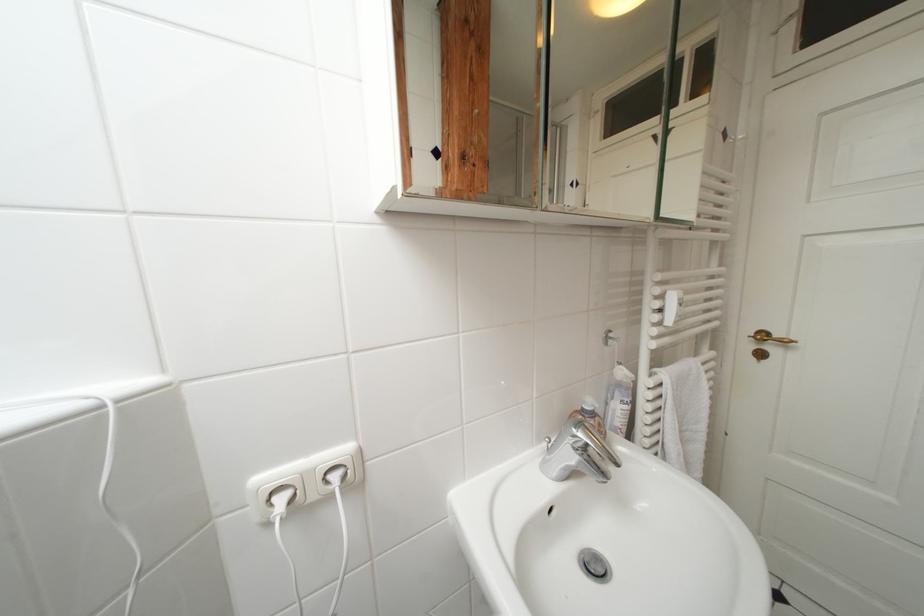
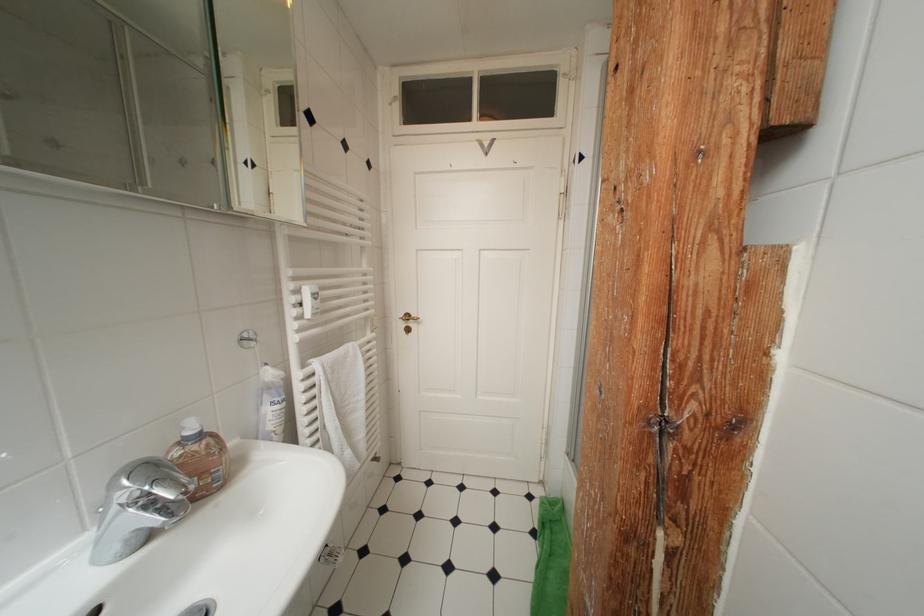
The point at (667, 300) is marked in the first image. Where is the corresponding point in the second image?

(304, 294)